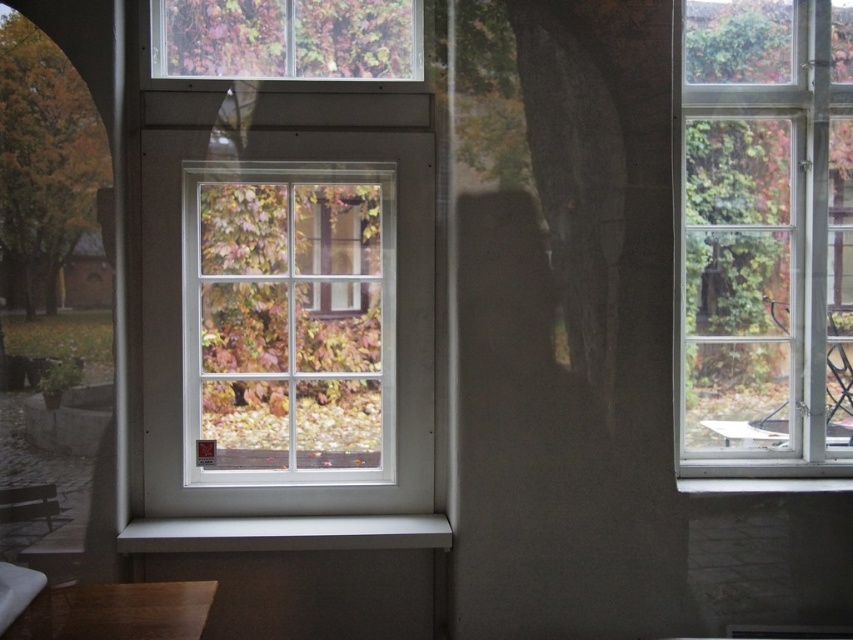
Looking at this image, you are standing in a room and want to look outside through the clear glass window at right. Where should you position yourself to ensure you can see the entire window frame?

To see the entire clear glass window at right, you should position yourself so that your line of sight includes the window frame at its 2D coordinate point at (762, 236).